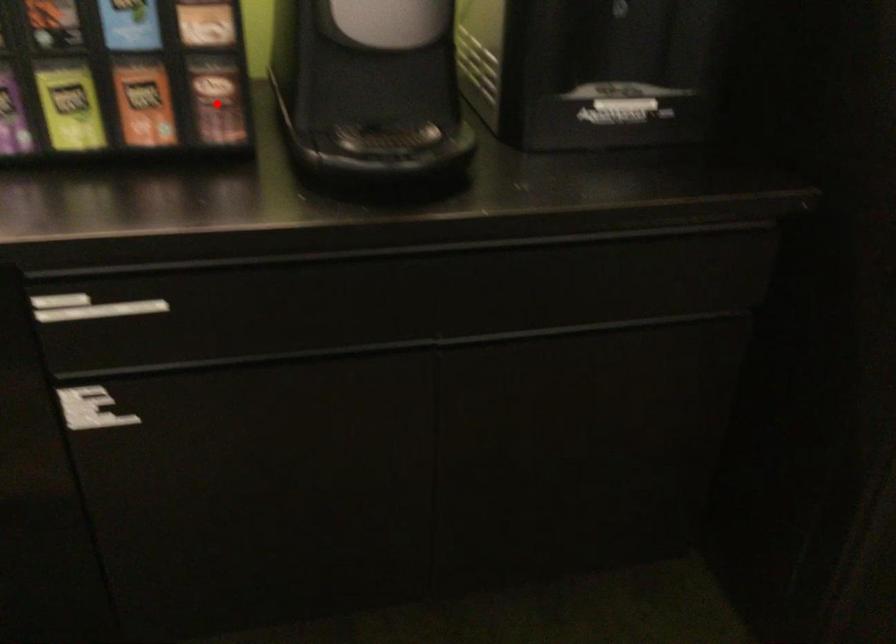
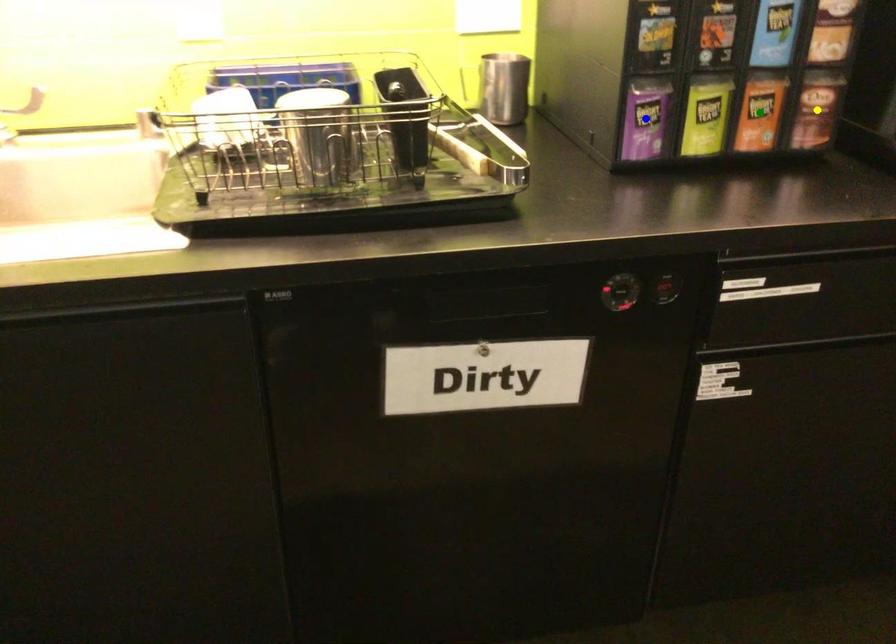
Question: I am providing you with two images of the same scene from different viewpoints. A red point is marked on the first image. You are given multiple points on the second image. Which spot in image 2 lines up with the point in image 1?

Choices:
 (A) green point
 (B) blue point
 (C) yellow point

Answer: (C)